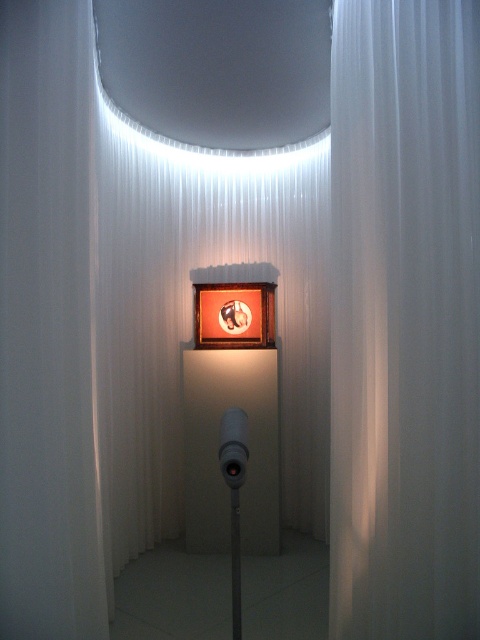
Question: From the image, what is the correct spatial relationship of white matte curtain at center in relation to matte white pole at center?

Choices:
 (A) right
 (B) left

Answer: (A)

Question: Is white matte curtain at center bigger than matte white pole at center?

Choices:
 (A) no
 (B) yes

Answer: (B)

Question: Which point appears farthest from the camera in this image?

Choices:
 (A) (233, 637)
 (B) (451, 444)

Answer: (B)

Question: Which object is farther from the camera taking this photo?

Choices:
 (A) white matte curtain at center
 (B) matte white pole at center

Answer: (A)

Question: Can you confirm if white matte curtain at center is positioned to the left of matte white pole at center?

Choices:
 (A) no
 (B) yes

Answer: (A)